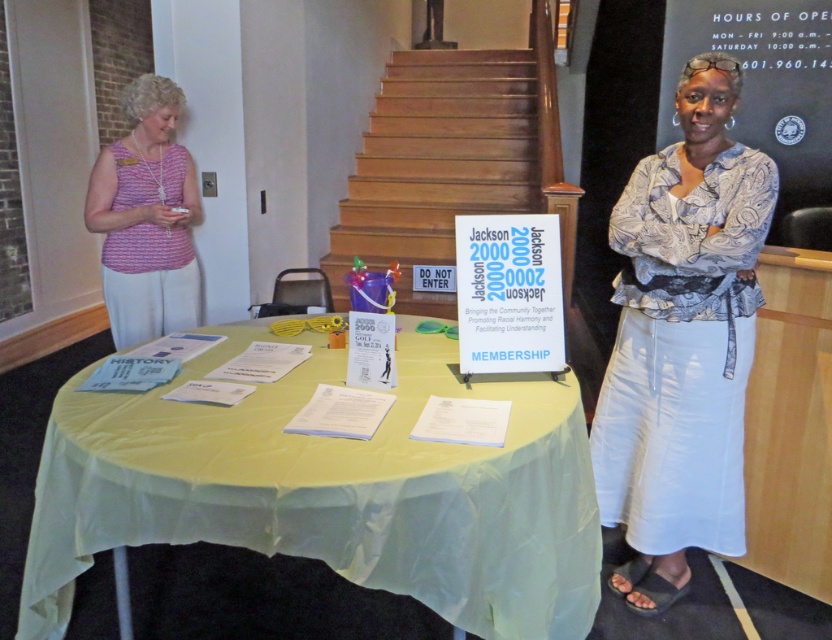
Question: Which point is closer to the camera?

Choices:
 (A) (409, 76)
 (B) (739, 211)
 (C) (201, 212)
 (D) (558, 388)

Answer: (B)

Question: Which of the following is the farthest from the observer?

Choices:
 (A) (107, 227)
 (B) (454, 298)
 (C) (518, 464)
 (D) (721, 323)

Answer: (B)

Question: Is yellow fabric-covered table at center positioned behind paisley-patterned blouse at center?

Choices:
 (A) yes
 (B) no

Answer: (B)

Question: Which object is the closest to the paisley-patterned blouse at center?

Choices:
 (A) pink fabric blouse at left
 (B) yellow fabric-covered table at center

Answer: (B)

Question: Does yellow fabric-covered table at center appear over pink fabric blouse at left?

Choices:
 (A) yes
 (B) no

Answer: (B)

Question: Considering the relative positions of yellow fabric-covered table at center and pink fabric blouse at left in the image provided, where is yellow fabric-covered table at center located with respect to pink fabric blouse at left?

Choices:
 (A) above
 (B) below

Answer: (B)